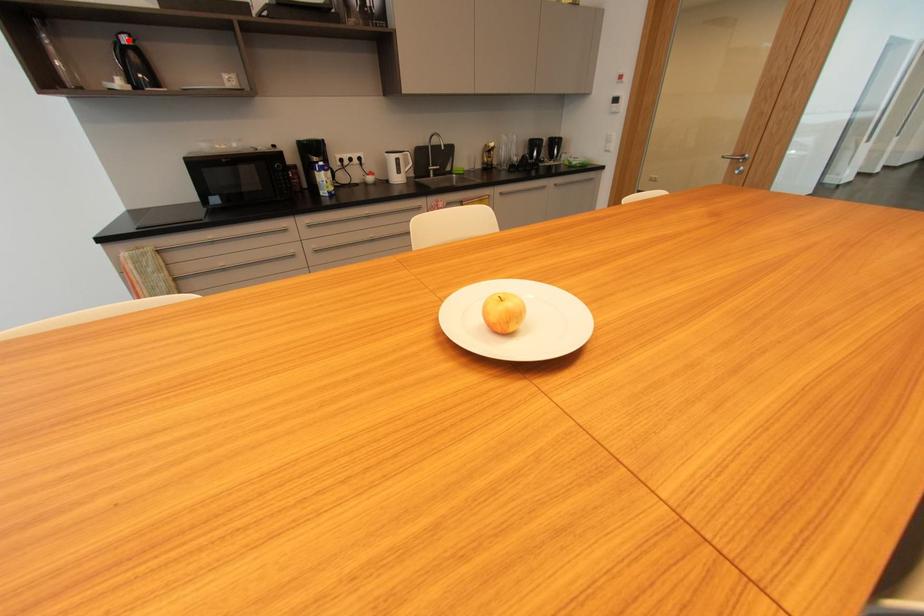
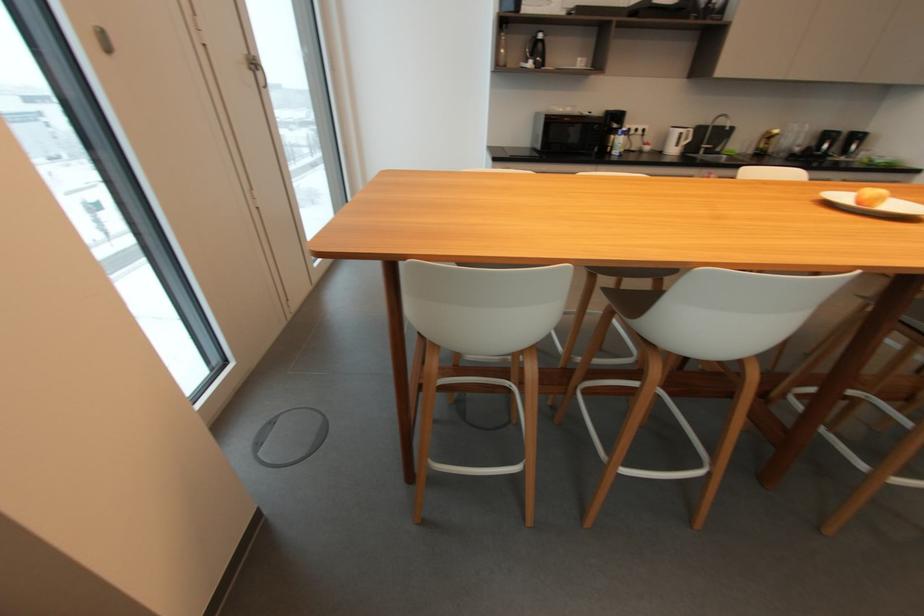
Question: I am providing you with two images of the same scene from different viewpoints. Given a red point in image1, look at the same physical point in image2. Is it:

Choices:
 (A) Closer to the viewpoint
 (B) Farther from the viewpoint

Answer: (A)